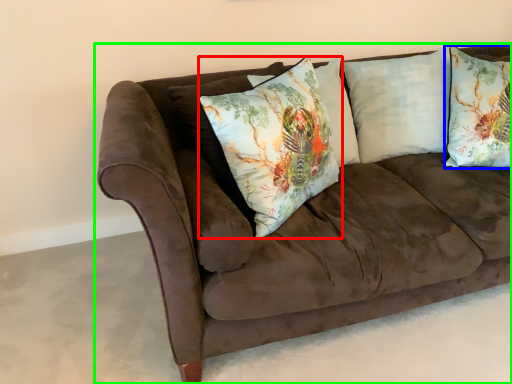
Question: Which object is the closest to the pillow (highlighted by a red box)? Choose among these: pillow (highlighted by a blue box) or studio couch (highlighted by a green box).

Choices:
 (A) pillow
 (B) studio couch

Answer: (B)